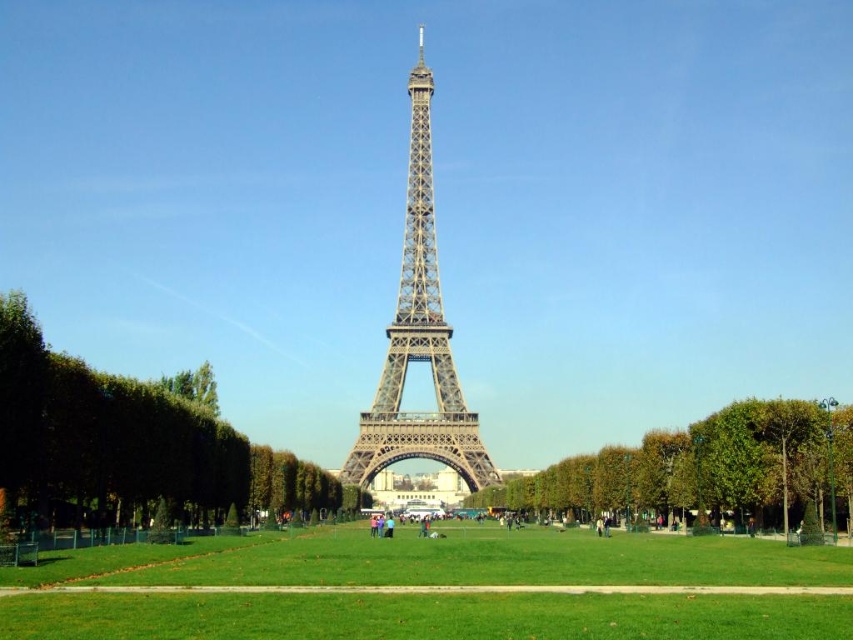
Does point (38, 518) lie in front of point (374, 426)?

Yes, point (38, 518) is in front of point (374, 426).

Can you confirm if green leafy tree at left is positioned to the right of metallic silver eiffel tower at center?

In fact, green leafy tree at left is to the left of metallic silver eiffel tower at center.

Is point (45, 506) closer to viewer compared to point (431, 189)?

Yes, point (45, 506) is in front of point (431, 189).

Identify the location of green leafy tree at left. This screenshot has width=853, height=640. (129, 445).

Who is higher up, green grass at center or green leafy tree at left?

Positioned higher is green leafy tree at left.

Can you confirm if green grass at center is positioned below green leafy tree at left?

Yes, green grass at center is below green leafy tree at left.

Is point (578, 573) farther from viewer compared to point (57, 419)?

Yes, point (578, 573) is farther from viewer.

At what (x,y) coordinates should I click in order to perform the action: click on green grass at center. Please return your answer as a coordinate pair (x, y). This screenshot has height=640, width=853. Looking at the image, I should click on (424, 618).

Who is more distant from viewer, (728, 625) or (347, 452)?

Point (347, 452)

Is point (631, 566) farther from viewer compared to point (467, 412)?

Yes.

At what (x,y) coordinates should I click in order to perform the action: click on green grass at center. Please return your answer as a coordinate pair (x, y). Looking at the image, I should click on (424, 618).